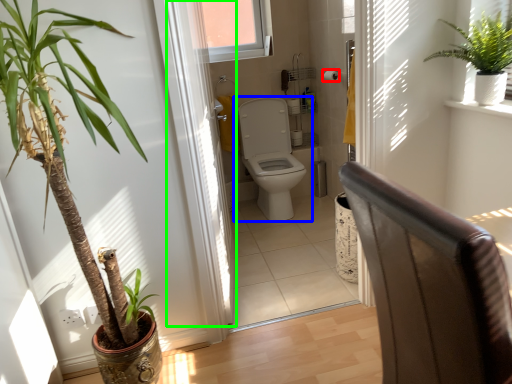
Question: Based on their relative distances, which object is nearer to toilet paper (highlighted by a red box)? Choose from toilet (highlighted by a blue box) and screen door (highlighted by a green box).

Choices:
 (A) toilet
 (B) screen door

Answer: (A)